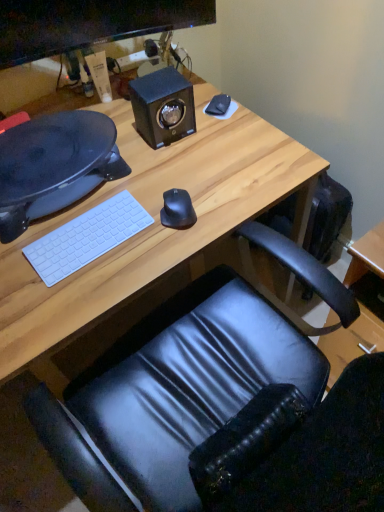
At what (x,y) coordinates should I click in order to perform the action: click on unoccupied area in front of black textured speaker at upper center. Please return your answer as a coordinate pair (x, y). This screenshot has height=512, width=384. Looking at the image, I should click on (170, 168).